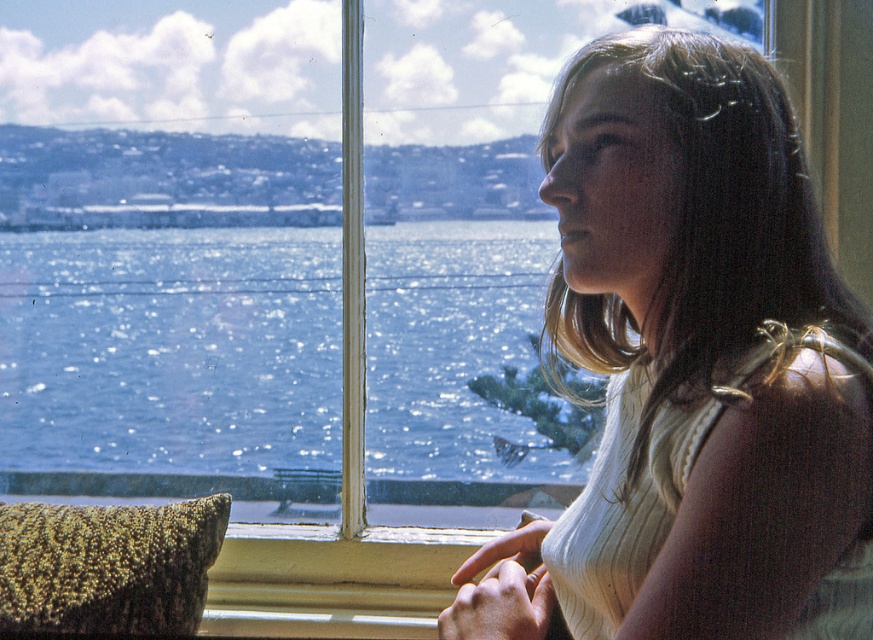
You are an interior designer assessing the proportions of clothing and water elements in the scene. Which object, the white ribbed tank top at center or the sparkling blue water at window center, occupies more visual space in the image?

The white ribbed tank top at center has a larger size compared to the sparkling blue water at window center, so it occupies more visual space in the image.

You are an interior designer planning to hang a rectangular mirror that is 1 meter tall on the wall. You want to place it between the sparkling blue water at window center and the green textured pillow at lower left. Considering their heights, will the mirror fit vertically between them?

The sparkling blue water at window center is taller than the green textured pillow at lower left. Since the mirror is 1 meter tall, it depends on the vertical space between them. However, the description only provides their relative heights, not the distance between them. Without knowing the exact vertical gap, we cannot confirm if the mirror will fit.

You are sitting on a chair in the room and want to look at the sparkling blue water at window center and the green textured pillow at lower left. Which object is closer to you?

The sparkling blue water at window center is closer to you because it is further to the viewer than the green textured pillow at lower left.